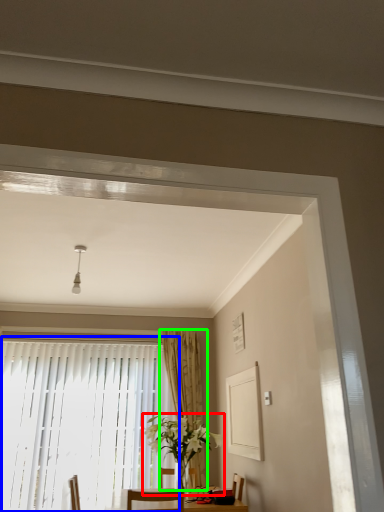
Question: Estimate the real-world distances between objects in this image. Which object is farther from houseplant (highlighted by a red box), window (highlighted by a blue box) or curtain (highlighted by a green box)?

Choices:
 (A) window
 (B) curtain

Answer: (A)